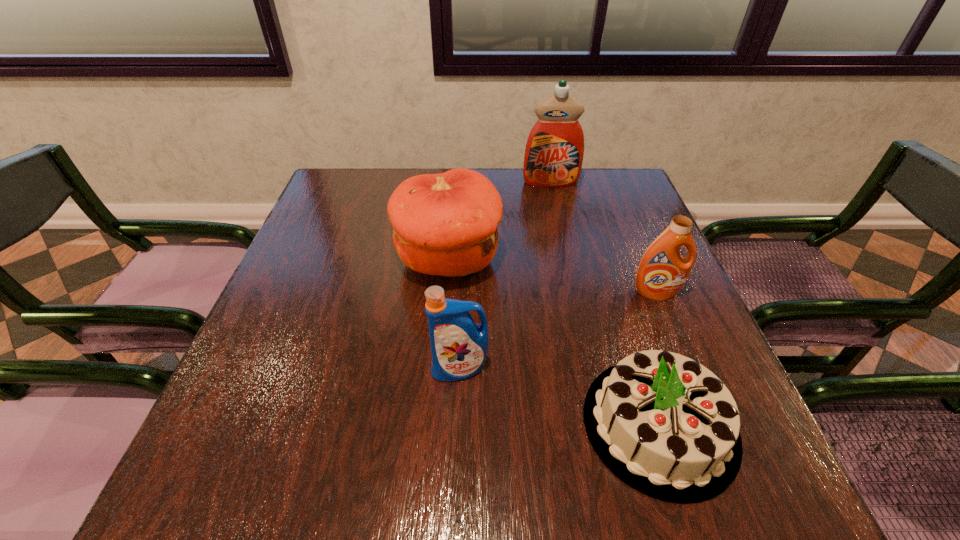
Locate an element on the screen. free spot that satisfies the following two spatial constraints: 1. on the label of the nearest detergent; 2. on the right side of the shortest object is located at coordinates (458, 424).